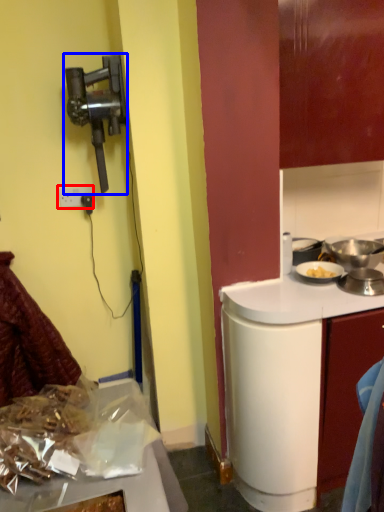
Question: Which of the following is the farthest to the observer, power outlet (highlighted by a red box) or home appliance (highlighted by a blue box)?

Choices:
 (A) power outlet
 (B) home appliance

Answer: (A)